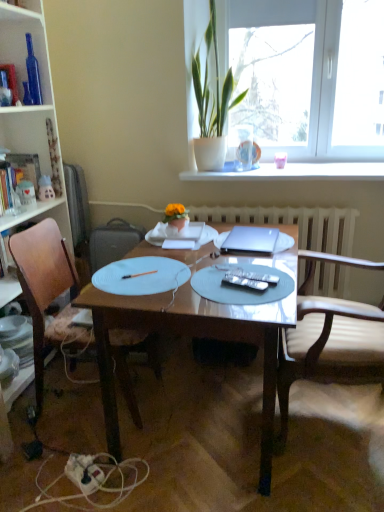
I want to click on vacant space underneath brown wood chair at left, which is the 1th chair in left-to-right order (from a real-world perspective), so click(x=86, y=400).